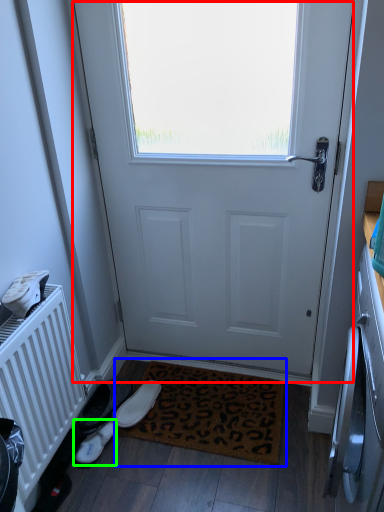
Question: Which is nearer to the door (highlighted by a red box)? doormat (highlighted by a blue box) or footwear (highlighted by a green box).

Choices:
 (A) doormat
 (B) footwear

Answer: (A)